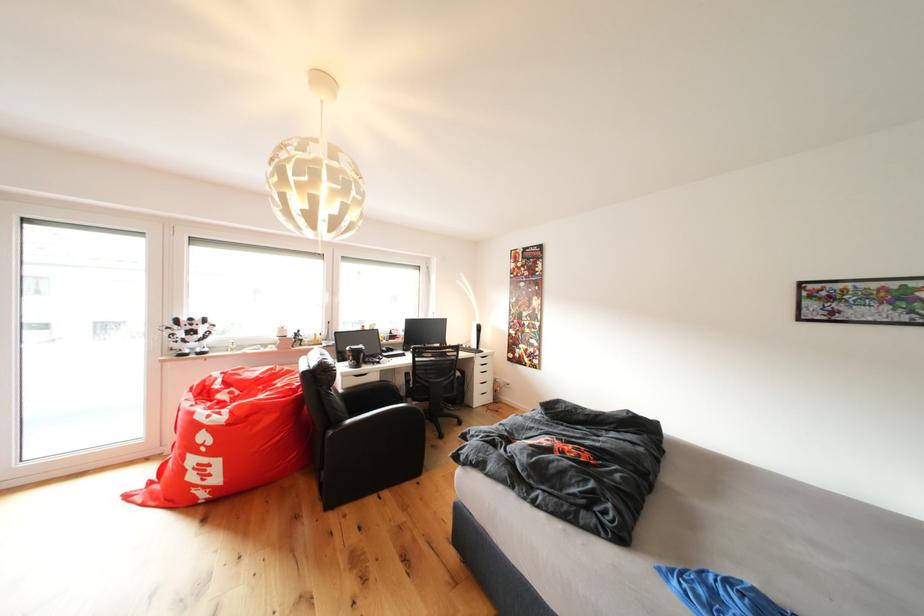
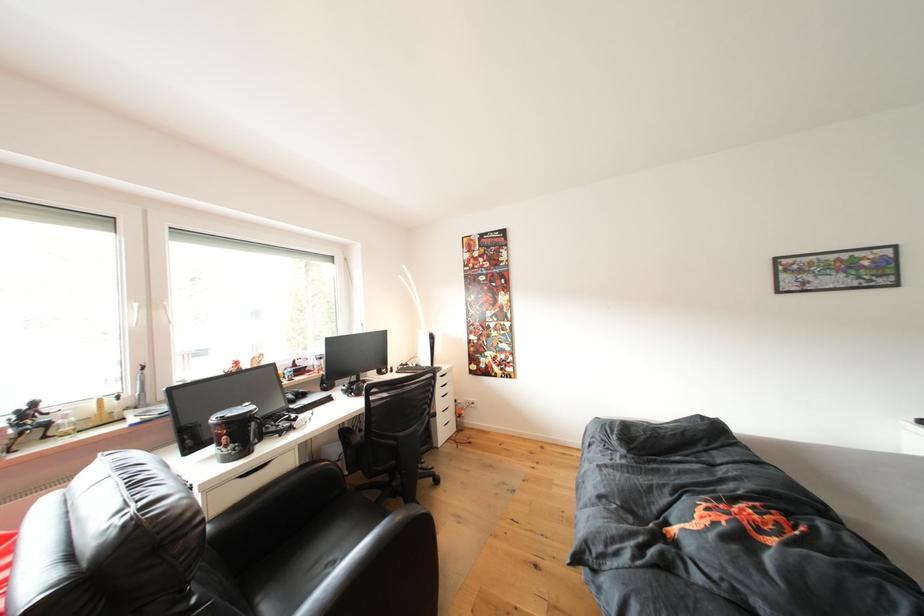
In the second image, find the point that corresponds to point (306, 339) in the first image.

(35, 419)